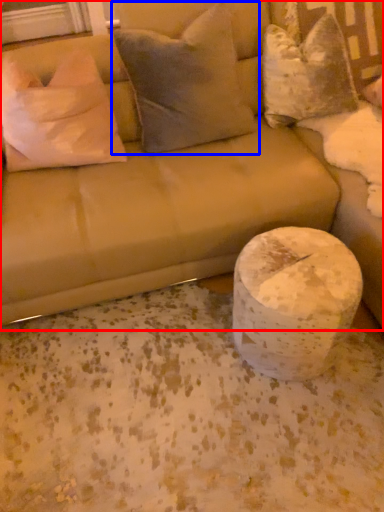
Question: Which object is further to the camera taking this photo, studio couch (highlighted by a red box) or pillow (highlighted by a blue box)?

Choices:
 (A) studio couch
 (B) pillow

Answer: (B)